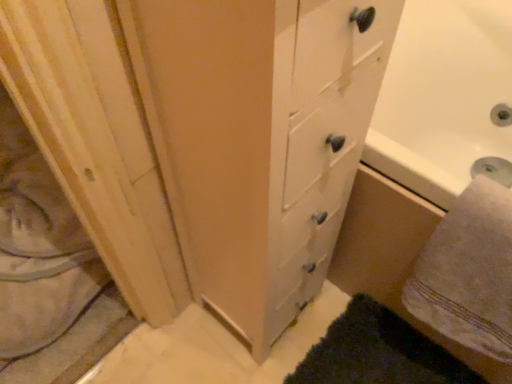
The image size is (512, 384). What do you see at coordinates (96, 141) in the screenshot? I see `natural wood screen door at left` at bounding box center [96, 141].

You are a GUI agent. You are given a task and a screenshot of the screen. Output one action in this format:
    pyautogui.click(x=<x>, y=<y>)
    Task: Click on the natural wood screen door at left
    The width and height of the screenshot is (512, 384).
    Given the screenshot: What is the action you would take?
    pyautogui.click(x=96, y=141)

Image resolution: width=512 pixels, height=384 pixels. I want to click on white soft towel at lower right, so click(469, 272).

In order to face white soft towel at lower right, should I rotate leftwards or rightwards?

To face it directly, rotate right by 29.019 degrees.

This screenshot has height=384, width=512. What do you see at coordinates (469, 272) in the screenshot?
I see `white soft towel at lower right` at bounding box center [469, 272].

Where is `natural wood screen door at left`? natural wood screen door at left is located at coordinates (96, 141).

Can you confirm if natural wood screen door at left is positioned to the right of white soft towel at lower right?

No, natural wood screen door at left is not to the right of white soft towel at lower right.

Which object is further away from the camera, natural wood screen door at left or white soft towel at lower right?

natural wood screen door at left is further from the camera.

Is point (4, 82) closer to viewer compared to point (473, 288)?

Yes.

From the image's perspective, is natural wood screen door at left above white soft towel at lower right?

Yes, from the image's perspective, natural wood screen door at left is on top of white soft towel at lower right.

Looking at this image, from a real-world perspective, between natural wood screen door at left and white soft towel at lower right, who is vertically lower?

natural wood screen door at left is physically lower.

Looking at their sizes, would you say natural wood screen door at left is wider or thinner than white soft towel at lower right?

Clearly, natural wood screen door at left has more width compared to white soft towel at lower right.

Considering the sizes of natural wood screen door at left and white soft towel at lower right in the image, is natural wood screen door at left taller or shorter than white soft towel at lower right?

natural wood screen door at left is shorter than white soft towel at lower right.

In the scene shown: Does natural wood screen door at left have a smaller size compared to white soft towel at lower right?

Actually, natural wood screen door at left might be larger than white soft towel at lower right.

Would you say natural wood screen door at left is outside white soft towel at lower right?

Indeed, natural wood screen door at left is completely outside white soft towel at lower right.

Is natural wood screen door at left far away from white soft towel at lower right?

No, natural wood screen door at left is not far away from white soft towel at lower right.

Is natural wood screen door at left oriented towards white soft towel at lower right?

No, natural wood screen door at left is not aimed at white soft towel at lower right.

At what (x,y) coordinates should I click in order to perform the action: click on screen door behind the white soft towel at lower right. Please return your answer as a coordinate pair (x, y). Looking at the image, I should click on [x=96, y=141].

Looking at this image, considering the positions of objects white soft towel at lower right and natural wood screen door at left in the image provided, who is more to the right, white soft towel at lower right or natural wood screen door at left?

white soft towel at lower right.

Is the depth of white soft towel at lower right greater than that of natural wood screen door at left?

No.

Between point (494, 205) and point (149, 312), which one is positioned in front?

The point (494, 205) is in front.

From the image's perspective, does white soft towel at lower right appear higher than natural wood screen door at left?

Incorrect, from the image's perspective, white soft towel at lower right is lower than natural wood screen door at left.

From a real-world perspective, which is physically above, white soft towel at lower right or natural wood screen door at left?

white soft towel at lower right.

Can you confirm if white soft towel at lower right is thinner than natural wood screen door at left?

Yes.

Considering the relative sizes of white soft towel at lower right and natural wood screen door at left in the image provided, is white soft towel at lower right shorter than natural wood screen door at left?

No.

Which of these two, white soft towel at lower right or natural wood screen door at left, is bigger?

With larger size is natural wood screen door at left.

Choose the correct answer: Is white soft towel at lower right inside natural wood screen door at left or outside it?

white soft towel at lower right is not inside natural wood screen door at left, it's outside.

Is white soft towel at lower right far from natural wood screen door at left?

They are positioned close to each other.

Is white soft towel at lower right facing away from natural wood screen door at left?

white soft towel at lower right does not have its back to natural wood screen door at left.

Based on the photo, can you tell me how much white soft towel at lower right and natural wood screen door at left differ in facing direction?

The angular difference between white soft towel at lower right and natural wood screen door at left is 0.781 degrees.

Locate an element on the screen. screen door lying on the left of white soft towel at lower right is located at coordinates (96, 141).

Identify the location of bath towel below the natural wood screen door at left (from the image's perspective). (469, 272).

There is a natural wood screen door at left. Where is `bath towel above it (from a real-world perspective)`? bath towel above it (from a real-world perspective) is located at coordinates (469, 272).